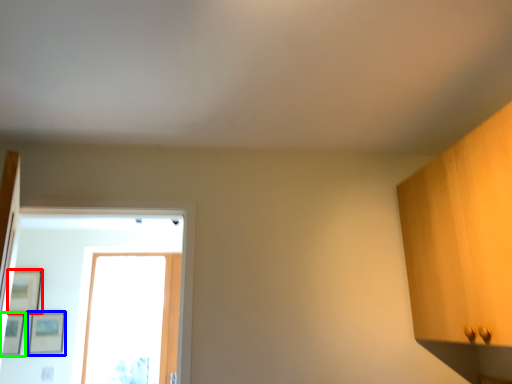
Question: Which object is positioned closest to picture frame (highlighted by a red box)? Select from picture frame (highlighted by a blue box) and picture frame (highlighted by a green box).

Choices:
 (A) picture frame
 (B) picture frame

Answer: (B)